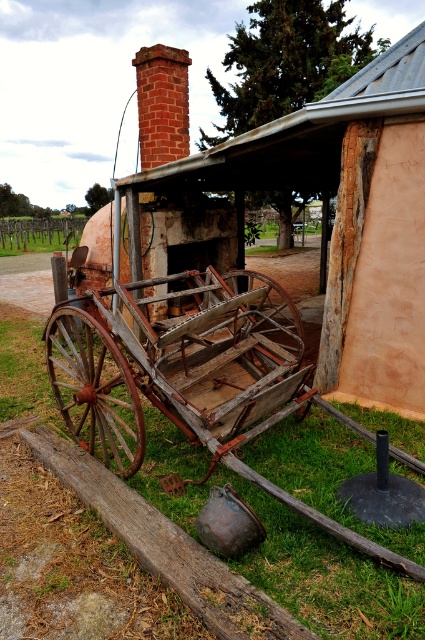
Who is more forward, (201, 172) or (113, 378)?

Positioned in front is point (113, 378).

Which is below, rusty wood cart at center or rusty wood wagon wheel at lower left?

rusty wood wagon wheel at lower left

Where is `rusty wood cart at center`? The width and height of the screenshot is (425, 640). rusty wood cart at center is located at coordinates (345, 218).

Find the location of a particular element. Image resolution: width=425 pixels, height=640 pixels. rusty wood cart at center is located at coordinates (345, 218).

Who is taller, rusty wood cart at lower left or rusty wooden wagon wheel at center?

rusty wood cart at lower left is taller.

Is rusty wood cart at lower left further to the viewer compared to rusty wooden wagon wheel at center?

No, it is not.

Image resolution: width=425 pixels, height=640 pixels. What are the coordinates of `rusty wood cart at lower left` in the screenshot? It's located at (190, 376).

Where is `rusty wood cart at lower left`? rusty wood cart at lower left is located at coordinates coord(190,376).

Which is more to the left, rusty wood cart at center or rusty wood cart at lower left?

Positioned to the left is rusty wood cart at lower left.

Who is more distant from viewer, (359, 349) or (212, 316)?

Point (359, 349)

Identify the location of rusty wood cart at center. (345, 218).